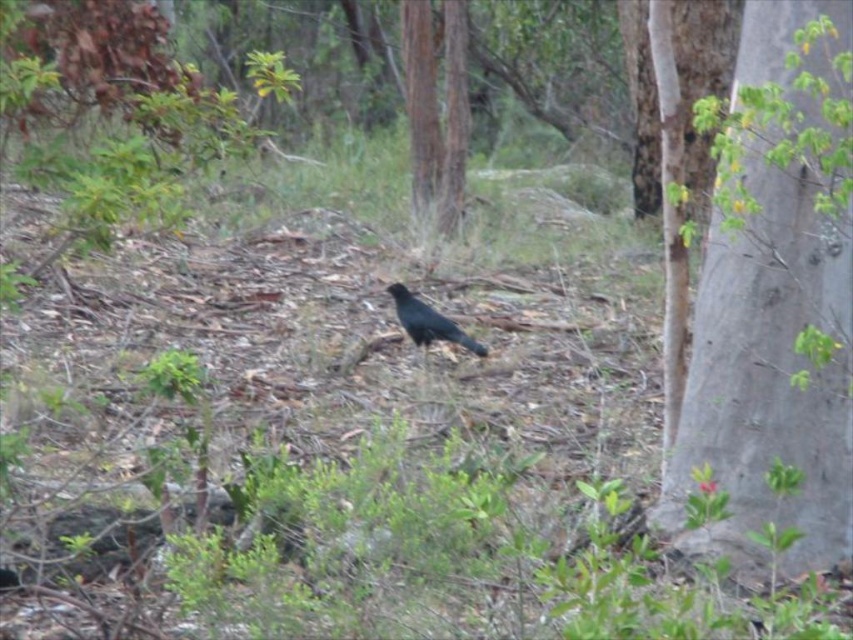
You are a hiker who wants to take a photo of the black bird standing on the ground in the midground. You notice a point at coordinates point (767, 376). Where exactly is this point located in the scene?

The point at coordinates point (767, 376) is located on the gray rough bark tree at right.

You are a photographer trying to capture the black bird in the midground. You notice two points in the scene marked as point 1 at coordinate (766,33) and point 2 at coordinate (439,140). Which point is closer to your camera lens?

Point 1 at coordinate (766,33) is closer to the camera lens than point 2 at coordinate (439,140).

You are standing in a forest scene with a black bird and various plants. You notice a point marked at coordinates (436, 108). What object is located at this point?

The point at coordinates (436, 108) corresponds to the smooth bark tree at center.